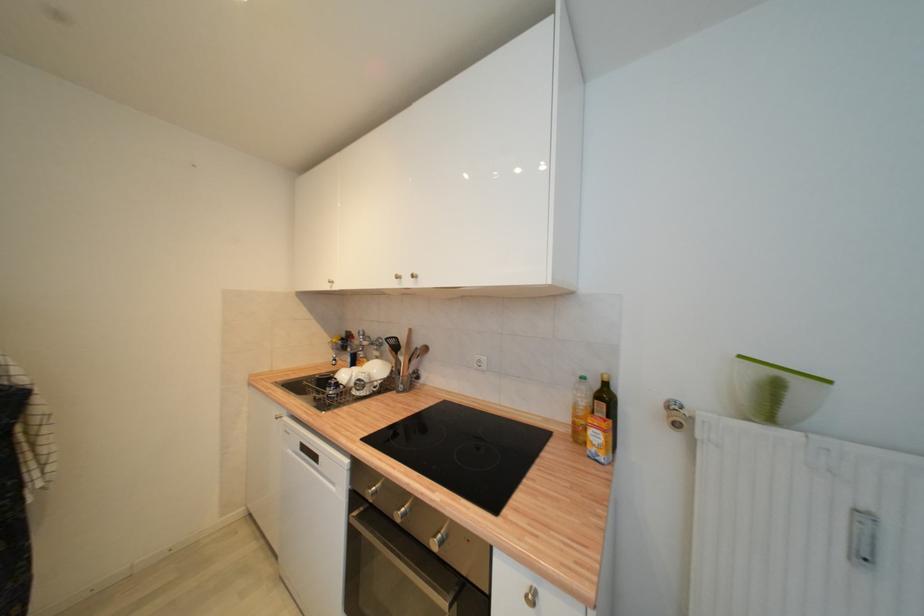
Identify the location of radiator valve. (803, 525).